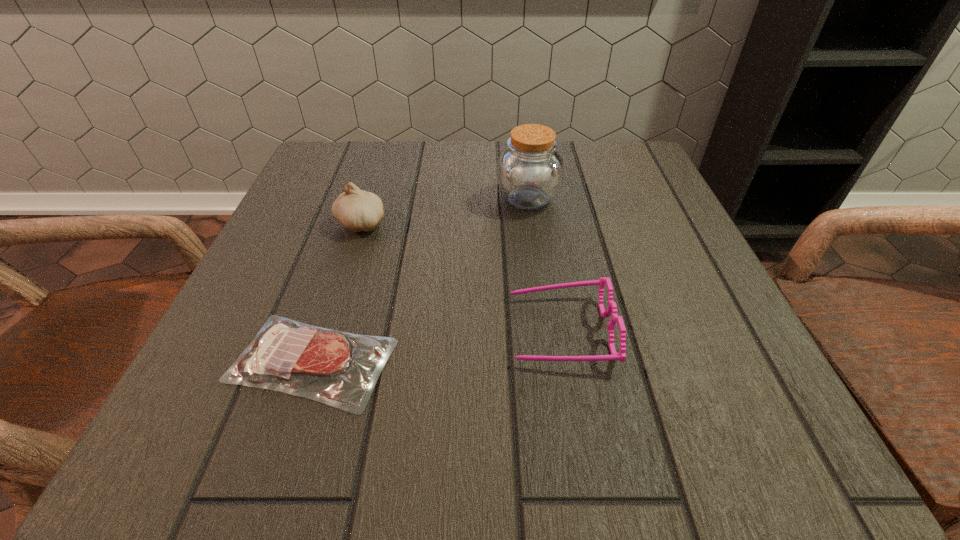
Find the location of a particular element. Image resolution: width=960 pixels, height=540 pixels. the tallest object is located at coordinates (530, 170).

The image size is (960, 540). I want to click on the second tallest object, so click(358, 210).

This screenshot has width=960, height=540. Find the location of `spectacles`. spectacles is located at coordinates (612, 307).

At what (x,y) coordinates should I click in order to perform the action: click on the shortest object. Please return your answer as a coordinate pair (x, y). Looking at the image, I should click on (286, 355).

The height and width of the screenshot is (540, 960). I want to click on free space located on the left of the jar, so click(x=396, y=198).

Identify the location of vacant space located 0.230m on the right of the third shortest object. (510, 224).

This screenshot has height=540, width=960. Identify the location of free spot located on the arms of the second shortest object. (421, 330).

Locate an element on the screen. The height and width of the screenshot is (540, 960). free location located 0.160m on the arms of the second shortest object is located at coordinates (401, 330).

This screenshot has width=960, height=540. What are the coordinates of `blank area located 0.140m on the arms of the second shortest object` in the screenshot? It's located at (415, 330).

Image resolution: width=960 pixels, height=540 pixels. What are the coordinates of `free space located 0.370m on the back of the shortest object` in the screenshot? It's located at (371, 183).